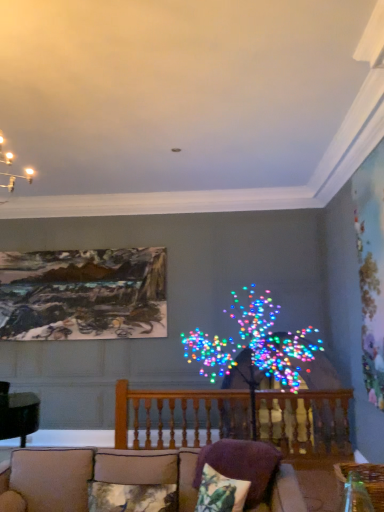
Question: From the image's perspective, is fluffy fabric pillow at lower center, which ranks as the 1th pillow in left-to-right order, above or below purple fabric pillow at lower center, the 1th pillow from the right?

Choices:
 (A) above
 (B) below

Answer: (B)

Question: Is point (155, 489) positioned closer to the camera than point (251, 480)?

Choices:
 (A) closer
 (B) farther

Answer: (B)

Question: Based on their relative distances, which object is farther from the purple fabric pillow at lower center, which is the 3th pillow in left-to-right order?

Choices:
 (A) fluffy fabric pillow at lower center, marked as the third pillow in a right-to-left arrangement
 (B) beige fabric couch at lower center
 (C) oil painting at upper left
 (D) wooden railing at center
 (E) floral fabric pillow at lower center, the 2th pillow when ordered from left to right

Answer: (C)

Question: Estimate the real-world distances between objects in this image. Which object is closer to the fluffy fabric pillow at lower center, marked as the third pillow in a right-to-left arrangement?

Choices:
 (A) purple fabric pillow at lower center, the 1th pillow from the right
 (B) beige fabric couch at lower center
 (C) oil painting at upper left
 (D) floral fabric pillow at lower center, placed as the 2th pillow when sorted from right to left
 (E) wooden railing at center

Answer: (B)